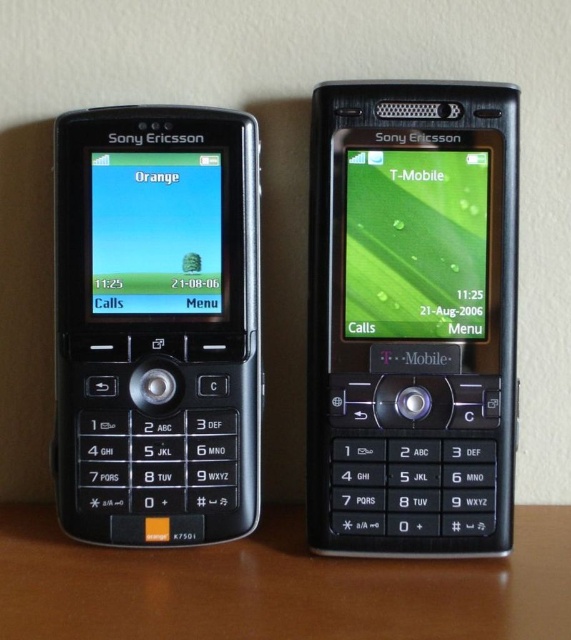
Which of these two, black plastic sony ericsson at center or black plastic keypad at lower center, stands shorter?

With less height is black plastic keypad at lower center.

Between point (377, 442) and point (408, 566), which one is positioned behind?

The point (377, 442) is more distant.

This screenshot has width=571, height=640. Identify the location of black plastic sony ericsson at center. (412, 317).